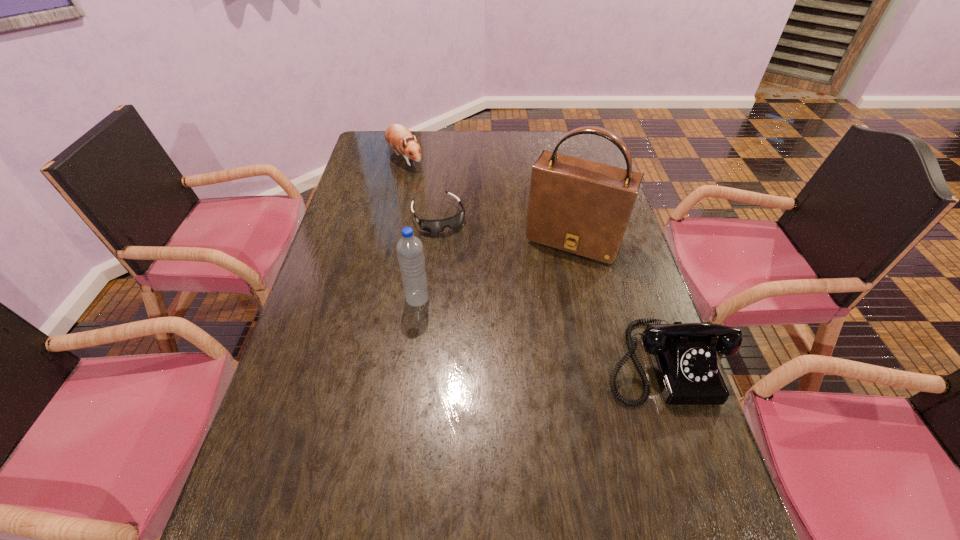
Find the location of a particular element. This screenshot has height=540, width=960. free area in between the second tallest object and the goggles is located at coordinates (428, 258).

Identify the location of free space between the telephone and the second shortest object. (534, 259).

Locate an element on the screen. The image size is (960, 540). empty space between the farthest object and the goggles is located at coordinates (421, 187).

You are a GUI agent. You are given a task and a screenshot of the screen. Output one action in this format:
    pyautogui.click(x=<x>, y=<y>)
    Task: Click on the free space between the fourth farthest object and the nearest object
    
    Given the screenshot: What is the action you would take?
    pyautogui.click(x=540, y=330)

What are the coordinates of `vacant area that lies between the tallest object and the hamster` in the screenshot? It's located at (490, 199).

The height and width of the screenshot is (540, 960). In order to click on free space between the tallest object and the second tallest object in this screenshot , I will do `click(495, 269)`.

Where is `vacant region between the goggles and the tallest object`? vacant region between the goggles and the tallest object is located at coordinates (507, 228).

You are a GUI agent. You are given a task and a screenshot of the screen. Output one action in this format:
    pyautogui.click(x=<x>, y=<y>)
    Task: Click on the vacant point located between the fourth shortest object and the telephone
    Image resolution: width=960 pixels, height=540 pixels.
    Given the screenshot: What is the action you would take?
    pyautogui.click(x=540, y=330)

The height and width of the screenshot is (540, 960). Identify the location of free point between the water bottle and the goggles. (428, 258).

Identify which object is located as the third nearest to the nearest object. Please provide its 2D coordinates. Your answer should be formatted as a tuple, i.e. [(x, y)], where the tuple contains the x and y coordinates of a point satisfying the conditions above.

[(433, 226)]